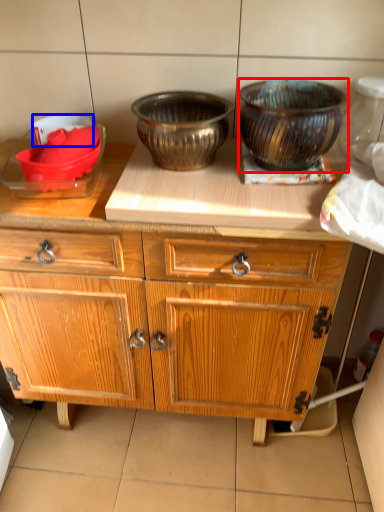
Question: Which object is further to the camera taking this photo, bowl (highlighted by a red box) or bowl (highlighted by a blue box)?

Choices:
 (A) bowl
 (B) bowl

Answer: (B)